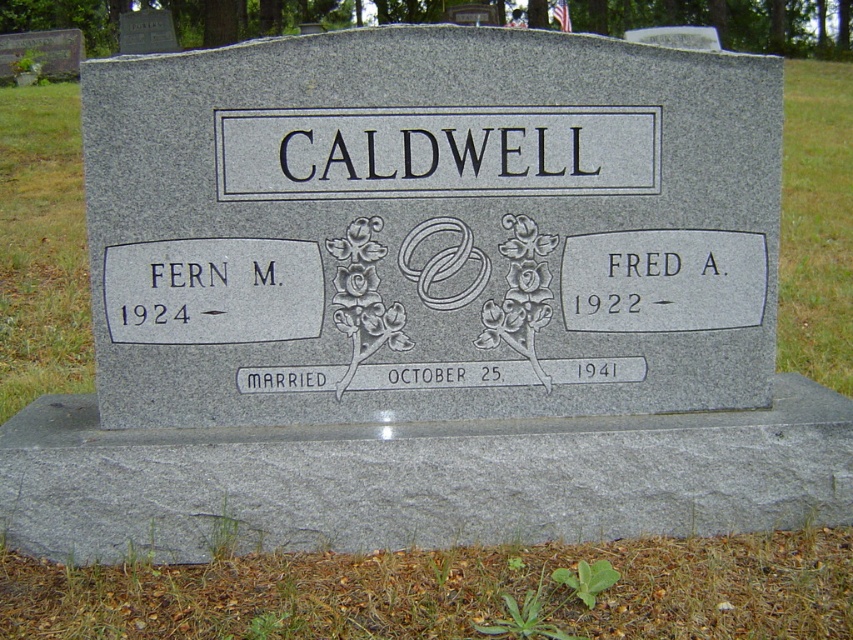
You are a gardener who needs to remove weeds from the cemetery. You see the black granite sign at center and the green leafy weed at lower center. Which object should you prioritize removing?

The green leafy weed at lower center should be prioritized for removal since it is smaller than the black granite sign at center, making it easier to handle first.

You are standing in a cemetery and see the black granite sign at center and the green leafy weed at lower center. Which object is taller?

The black granite sign at center is taller than the green leafy weed at lower center.